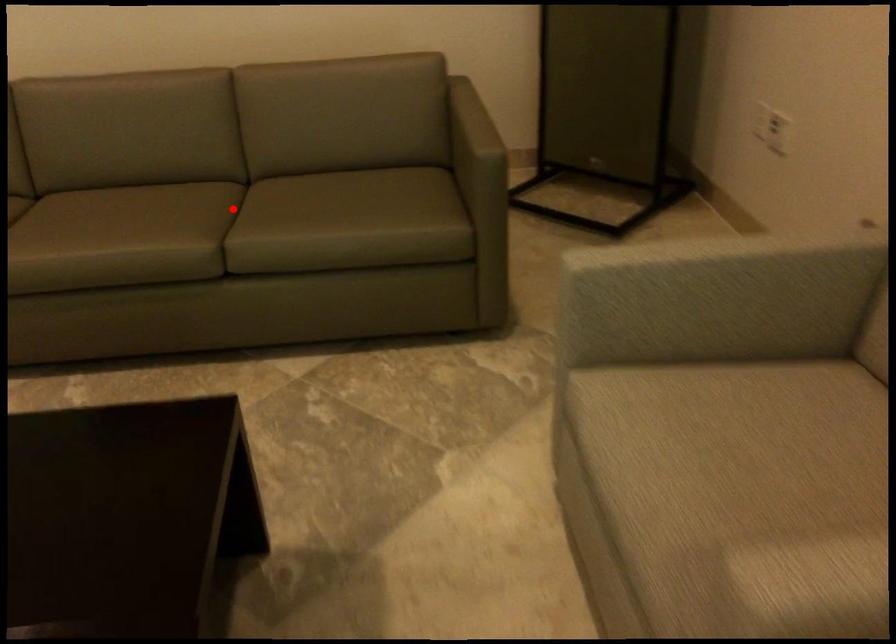
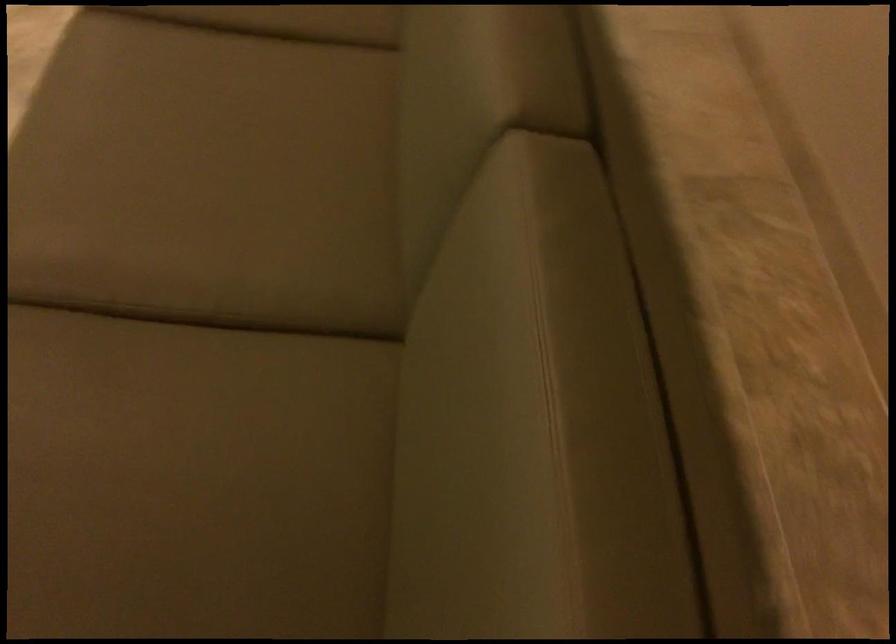
Question: A red point is marked in image1. In image2, is the corresponding 3D point closer to the camera or farther? Reply with the corresponding letter.

Choices:
 (A) The corresponding 3D point is closer.
 (B) The corresponding 3D point is farther.

Answer: (A)